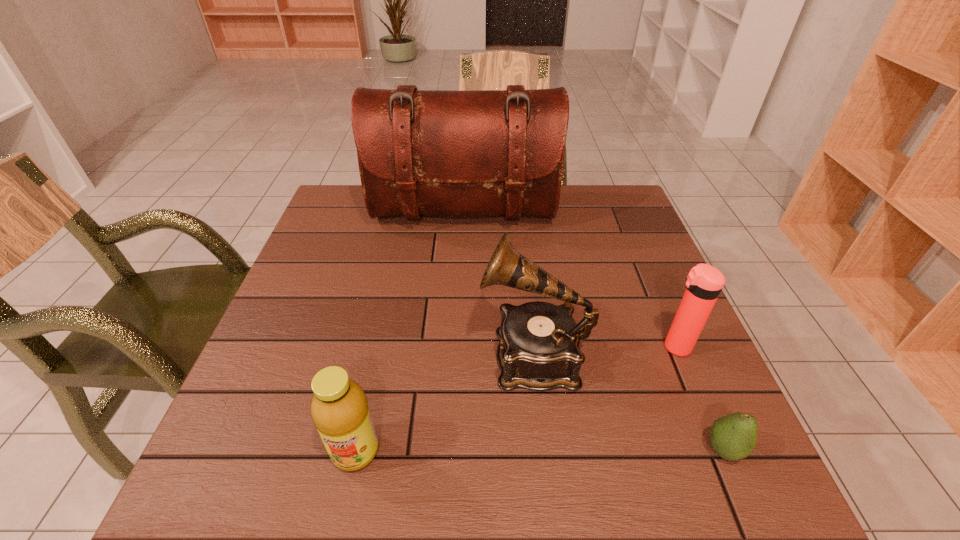
The image size is (960, 540). I want to click on the farthest object, so click(420, 152).

Locate an element on the screen. the tallest object is located at coordinates (420, 152).

Find the location of `the fourth shortest object`. the fourth shortest object is located at coordinates (539, 350).

At what (x,y) coordinates should I click in order to perform the action: click on thermos bottle. Please return your answer as a coordinate pair (x, y). This screenshot has width=960, height=540. Looking at the image, I should click on (704, 282).

What are the coordinates of `fruit juice` in the screenshot? It's located at (339, 409).

Locate an element on the screen. avocado is located at coordinates (733, 437).

This screenshot has height=540, width=960. Identify the location of free space located 0.130m on the front-facing side of the satchel. (461, 272).

You are a GUI agent. You are given a task and a screenshot of the screen. Output one action in this format:
    pyautogui.click(x=<x>, y=<y>)
    Task: Click on the free region located 0.150m on the horn of the phonograph record
    The width and height of the screenshot is (960, 540).
    Given the screenshot: What is the action you would take?
    pyautogui.click(x=406, y=355)

In order to click on vacant space located on the horn of the phonograph record in this screenshot , I will do `click(441, 355)`.

The height and width of the screenshot is (540, 960). Identify the location of blank area located 0.300m on the horn of the phonograph record. (333, 355).